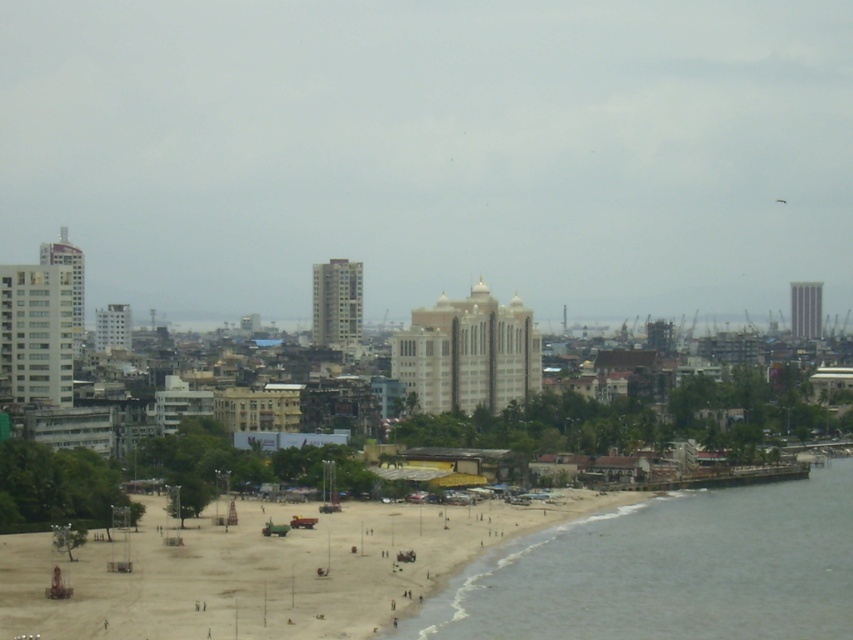
Who is shorter, matte white building at center or grayish-green water at beach right?

With less height is grayish-green water at beach right.

Does matte white building at center appear on the right side of grayish-green water at beach right?

No, matte white building at center is not to the right of grayish-green water at beach right.

Who is more forward, (x=611, y=209) or (x=538, y=538)?

Point (x=538, y=538)

Locate an element on the screen. This screenshot has height=640, width=853. matte white building at center is located at coordinates (432, 150).

Between matte white building at center and brown sand beach at lower right, which one is positioned higher?

matte white building at center

Can you confirm if matte white building at center is thinner than brown sand beach at lower right?

Incorrect, matte white building at center's width is not less than brown sand beach at lower right's.

You are a GUI agent. You are given a task and a screenshot of the screen. Output one action in this format:
    pyautogui.click(x=<x>, y=<y>)
    Task: Click on the matte white building at center
    The image size is (853, 640).
    Given the screenshot: What is the action you would take?
    pyautogui.click(x=432, y=150)

Does brown sand beach at lower right have a greater height compared to grayish-green water at beach right?

In fact, brown sand beach at lower right may be shorter than grayish-green water at beach right.

Is brown sand beach at lower right to the left of grayish-green water at beach right from the viewer's perspective?

Correct, you'll find brown sand beach at lower right to the left of grayish-green water at beach right.

Locate an element on the screen. The width and height of the screenshot is (853, 640). brown sand beach at lower right is located at coordinates (265, 570).

At what (x,y) coordinates should I click in order to perform the action: click on brown sand beach at lower right. Please return your answer as a coordinate pair (x, y). Looking at the image, I should click on (265, 570).